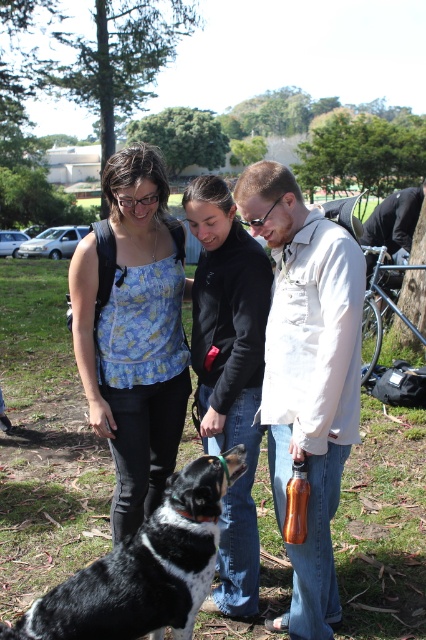
Question: Does matte white shirt at center have a lesser width compared to matte floral tank top at center?

Choices:
 (A) yes
 (B) no

Answer: (A)

Question: Can you confirm if matte floral tank top at center is positioned below black matte jacket at center?

Choices:
 (A) no
 (B) yes

Answer: (A)

Question: Among these objects, which one is farthest from the camera?

Choices:
 (A) bronze metallic bottle at lower center
 (B) black matte jacket at center

Answer: (B)

Question: Which of the following is the farthest from the observer?

Choices:
 (A) black matte jacket at center
 (B) black and white fur at center
 (C) matte white shirt at center

Answer: (A)

Question: Which is farther from the matte floral tank top at center?

Choices:
 (A) black and white fur at center
 (B) black matte jacket at center
 (C) matte white shirt at center

Answer: (C)

Question: Can you confirm if matte white shirt at center is positioned above black matte jacket at center?

Choices:
 (A) no
 (B) yes

Answer: (B)